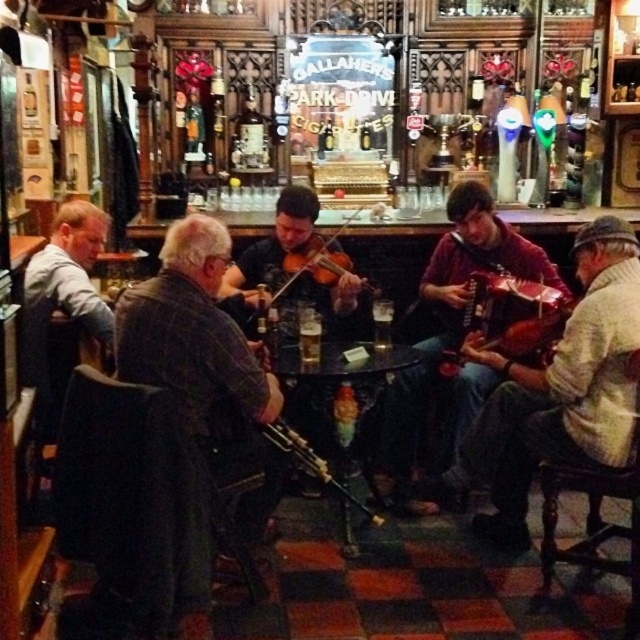
Can you confirm if dark brown leather jacket at center is bigger than wooden violin at center?

Incorrect, dark brown leather jacket at center is not larger than wooden violin at center.

Can you confirm if dark brown leather jacket at center is positioned below wooden violin at center?

Yes.

Identify the location of dark brown leather jacket at center. (195, 337).

Is point (157, 326) less distant than point (300, 467)?

Yes.

Does dark brown leather jacket at center have a greater height compared to wooden bagpipe at center?

Yes, dark brown leather jacket at center is taller than wooden bagpipe at center.

The image size is (640, 640). Find the location of `dark brown leather jacket at center`. dark brown leather jacket at center is located at coordinates (195, 337).

From the picture: Does dark brown leather jacket at center have a lesser height compared to gray wool sweater at left?

No, dark brown leather jacket at center is not shorter than gray wool sweater at left.

Can you confirm if dark brown leather jacket at center is positioned to the right of gray wool sweater at left?

Correct, you'll find dark brown leather jacket at center to the right of gray wool sweater at left.

Find the location of `dark brown leather jacket at center`. dark brown leather jacket at center is located at coordinates (195, 337).

Where is `dark brown leather jacket at center`? The height and width of the screenshot is (640, 640). dark brown leather jacket at center is located at coordinates tap(195, 337).